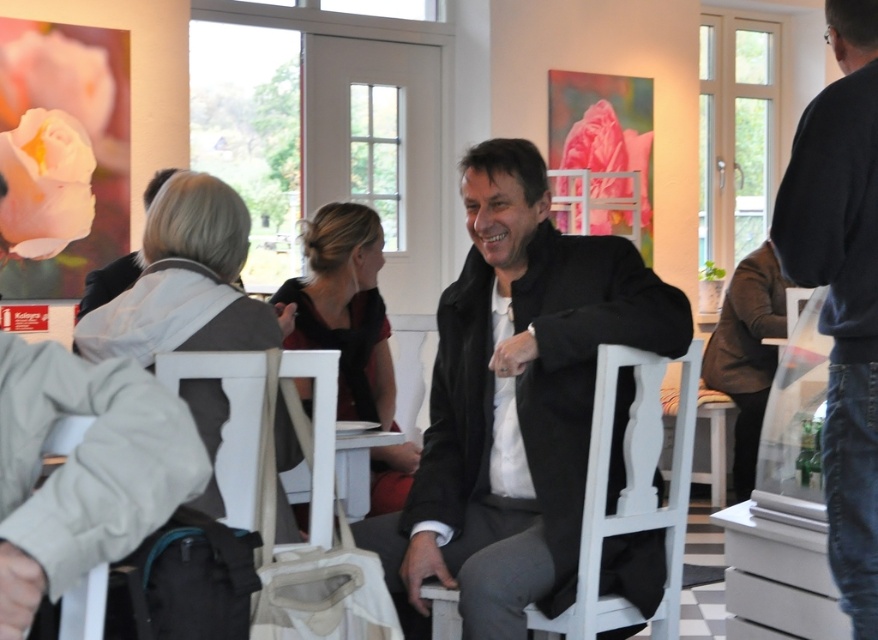
Question: Can you confirm if dark blue shirt at right is positioned above light gray fabric jacket at center?

Choices:
 (A) yes
 (B) no

Answer: (A)

Question: Which of the following is the closest to the observer?

Choices:
 (A) (511, 356)
 (B) (144, 192)
 (C) (598, 385)

Answer: (A)

Question: Which of these objects is positioned closest to the matte black jacket at center?

Choices:
 (A) white wood chair at lower left
 (B) light gray fabric jacket at center
 (C) black matte jacket at center

Answer: (B)

Question: Which is farther from the matte black jacket at center?

Choices:
 (A) white wood chair at lower left
 (B) black matte jacket at center
 (C) matte black dress at center
 (D) white wood chair at center

Answer: (D)

Question: Does white wood chair at center appear on the right side of matte black dress at center?

Choices:
 (A) no
 (B) yes

Answer: (B)

Question: Is black matte jacket at center smaller than dark blue shirt at right?

Choices:
 (A) no
 (B) yes

Answer: (A)